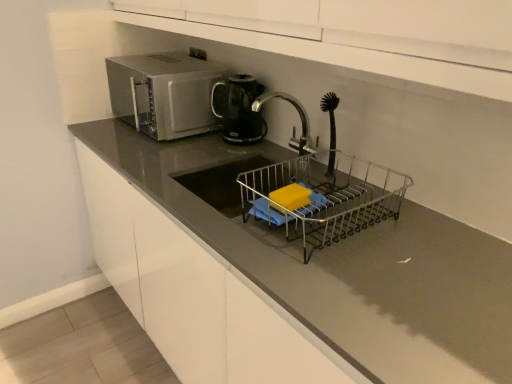
Where is `empty space that is to the right of yellow sponge at sink`? empty space that is to the right of yellow sponge at sink is located at coordinates point(356,225).